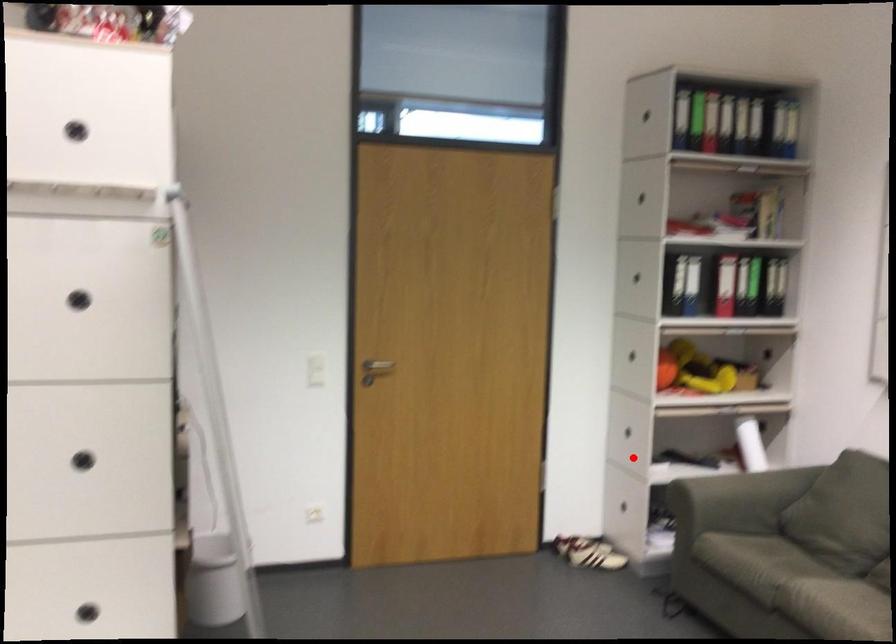
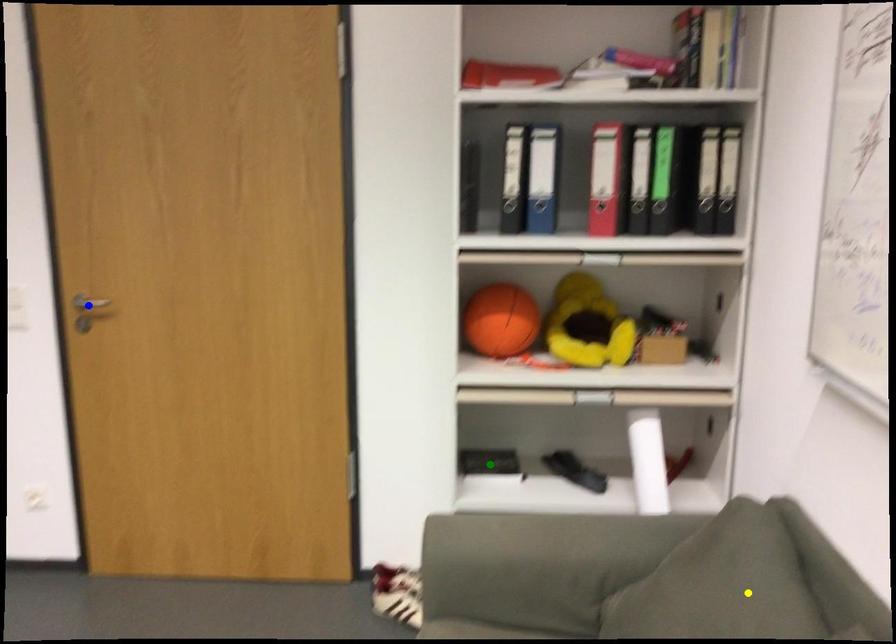
Question: I am providing you with two images of the same scene from different viewpoints. A red point is marked on the first image. You are given multiple points on the second image. Which point in image 2 represents the same 3d spot as the red point in image 1?

Choices:
 (A) yellow point
 (B) blue point
 (C) green point

Answer: (C)